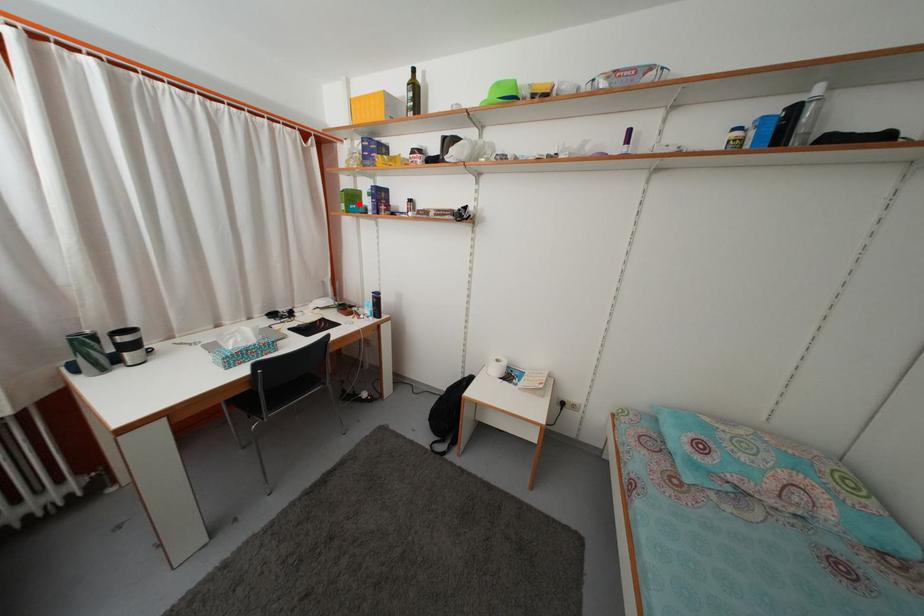
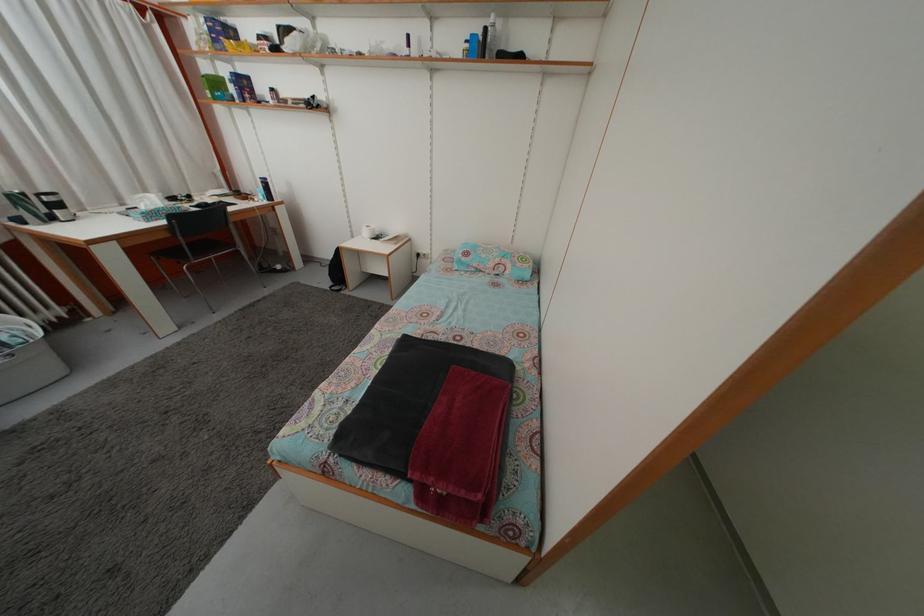
Question: I am providing you with two images of the same scene from different viewpoints. Given a red point in image1, look at the same physical point in image2. Is it:

Choices:
 (A) Closer to the viewpoint
 (B) Farther from the viewpoint

Answer: (B)